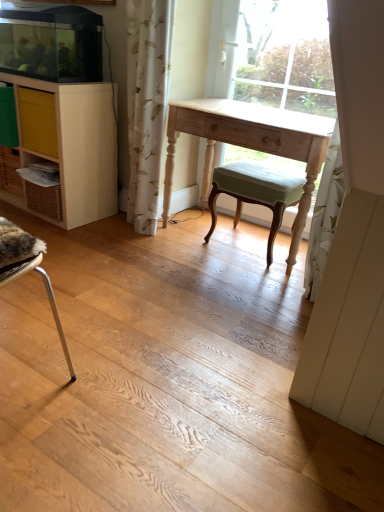
This screenshot has height=512, width=384. I want to click on free space to the left of light green fabric stool at center, so click(x=192, y=240).